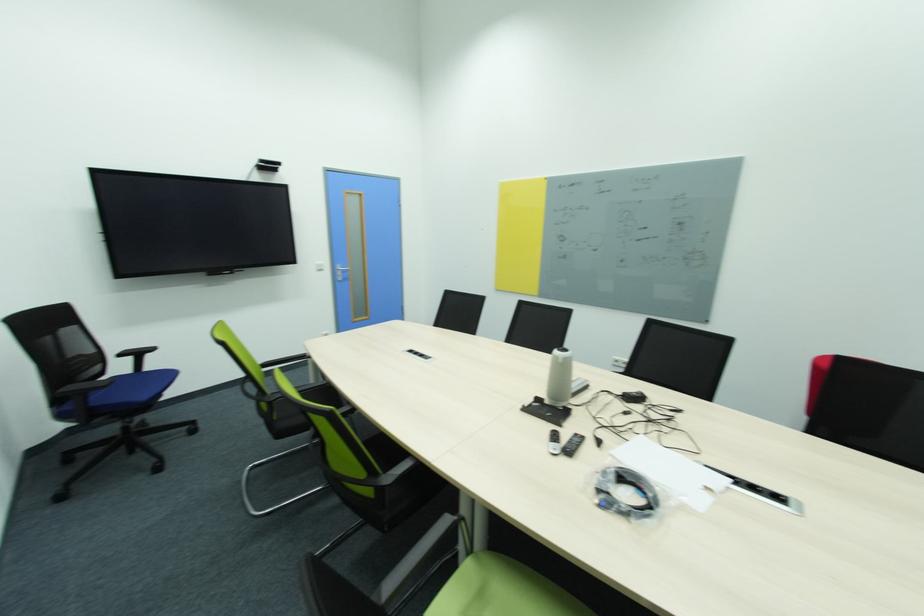
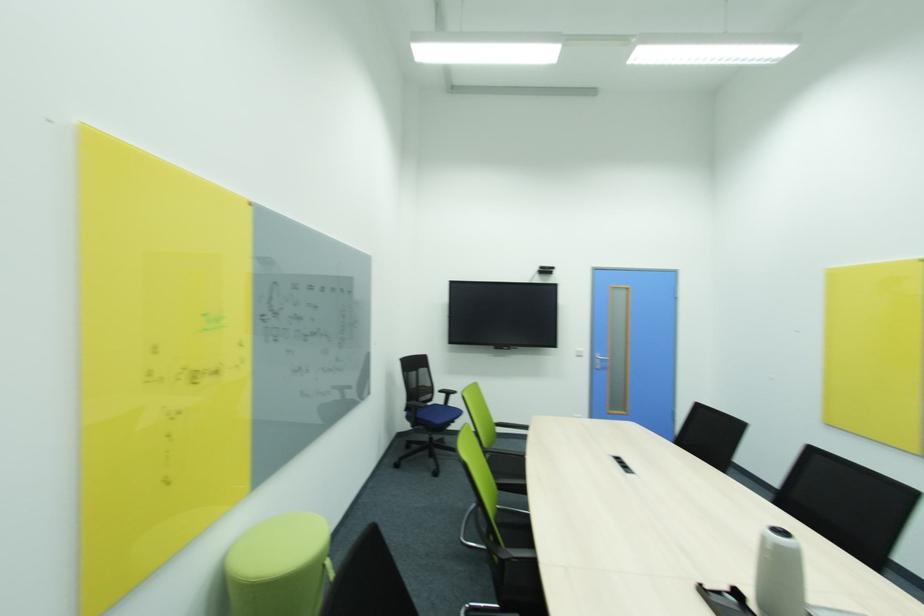
Find the pixel in the second image that matches [73,331] in the first image.

(428, 371)